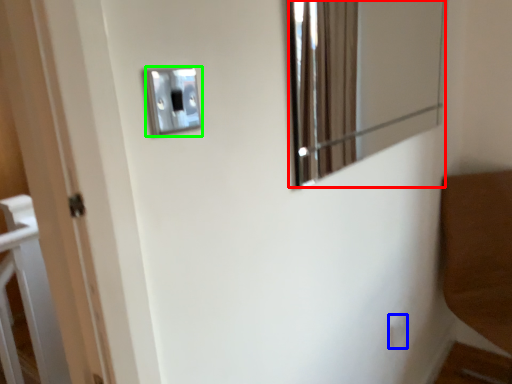
Question: Which object is positioned farthest from mirror (highlighted by a red box)? Select from light switch (highlighted by a blue box) and light switch (highlighted by a green box).

Choices:
 (A) light switch
 (B) light switch

Answer: (B)